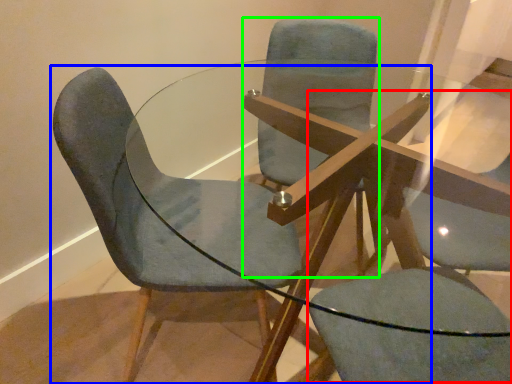
Question: Considering the real-world distances, which object is farthest from swivel chair (highlighted by a red box)? chair (highlighted by a blue box) or chair (highlighted by a green box)?

Choices:
 (A) chair
 (B) chair

Answer: (B)